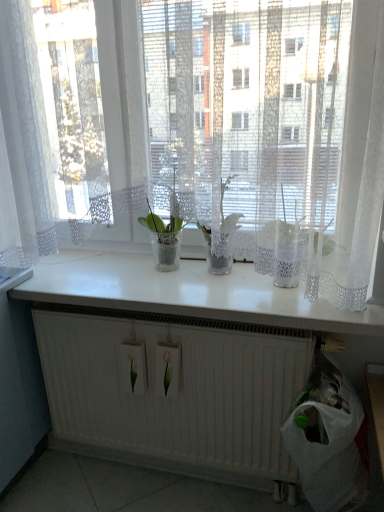
Image resolution: width=384 pixels, height=512 pixels. I want to click on vacant space situated on the left part of translucent glass vase at center, so pyautogui.click(x=106, y=273).